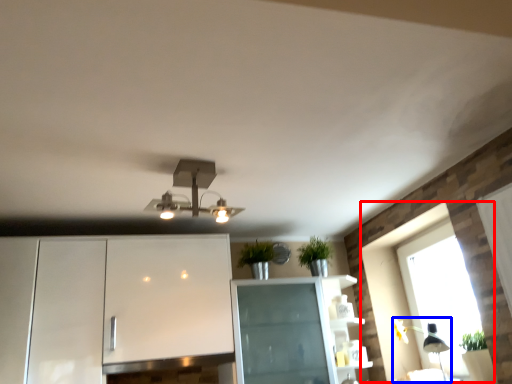
Question: Which object appears farthest to the camera in this image, window (highlighted by a red box) or light fixture (highlighted by a blue box)?

Choices:
 (A) window
 (B) light fixture

Answer: (A)